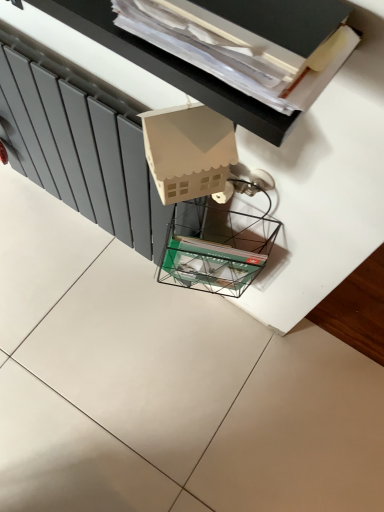
Where is `free point below matte cardboard house at upper center (from a real-world perspective)`? The width and height of the screenshot is (384, 512). free point below matte cardboard house at upper center (from a real-world perspective) is located at coordinates (178, 315).